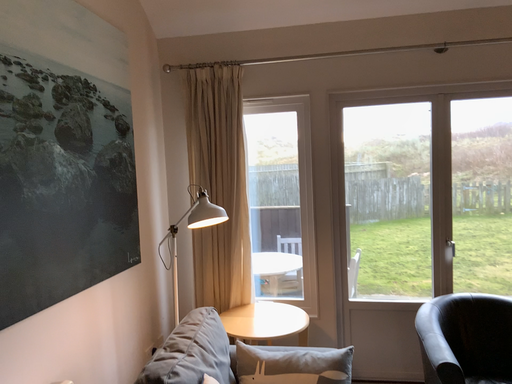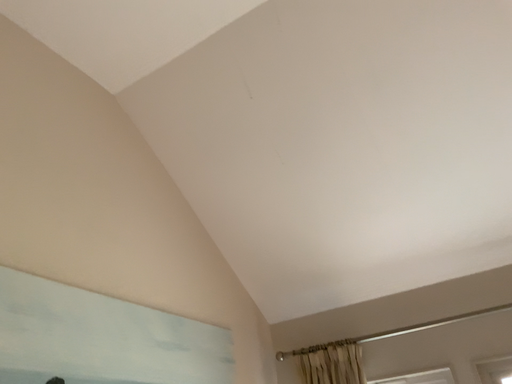
Question: How did the camera likely rotate when shooting the video?

Choices:
 (A) rotated upward
 (B) rotated downward

Answer: (A)